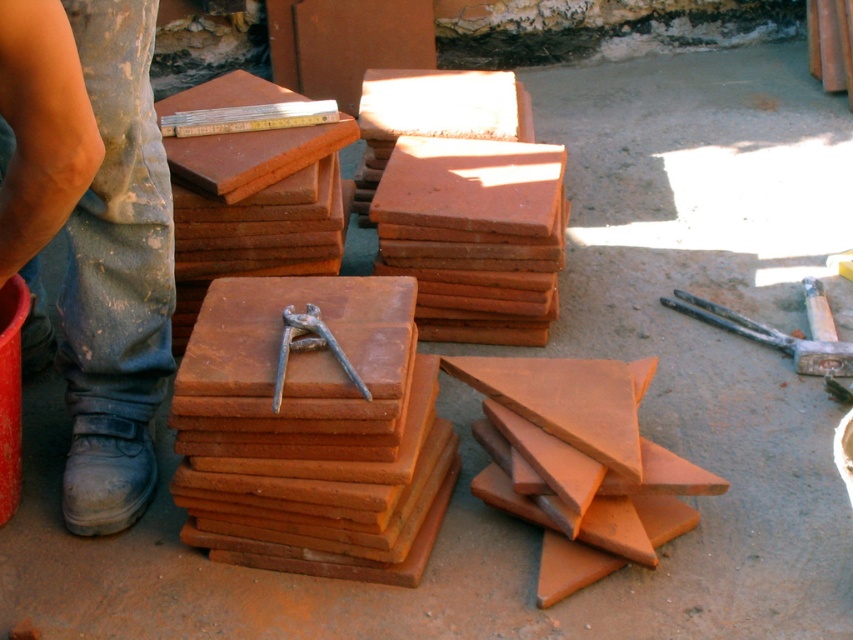
Question: Among these objects, which one is farthest from the camera?

Choices:
 (A) rusty metal pliers at center
 (B) rusty metal hammer at lower right

Answer: (B)

Question: Can you confirm if blue jeans at lower left is bigger than rusty metal hammer at lower right?

Choices:
 (A) no
 (B) yes

Answer: (B)

Question: Among these objects, which one is farthest from the camera?

Choices:
 (A) terracotta clay tiles at center
 (B) terracotta clay tiles at lower right
 (C) rusty metal pliers at center

Answer: (B)

Question: Can you confirm if terracotta clay tiles at center is positioned to the right of terracotta clay tiles at lower right?

Choices:
 (A) yes
 (B) no

Answer: (B)

Question: Does rusty metal hammer at lower right appear on the right side of rusty metal pliers at center?

Choices:
 (A) yes
 (B) no

Answer: (A)

Question: Which point is farther from the camera taking this photo?

Choices:
 (A) (322, 328)
 (B) (305, 465)
 (C) (842, 348)

Answer: (C)